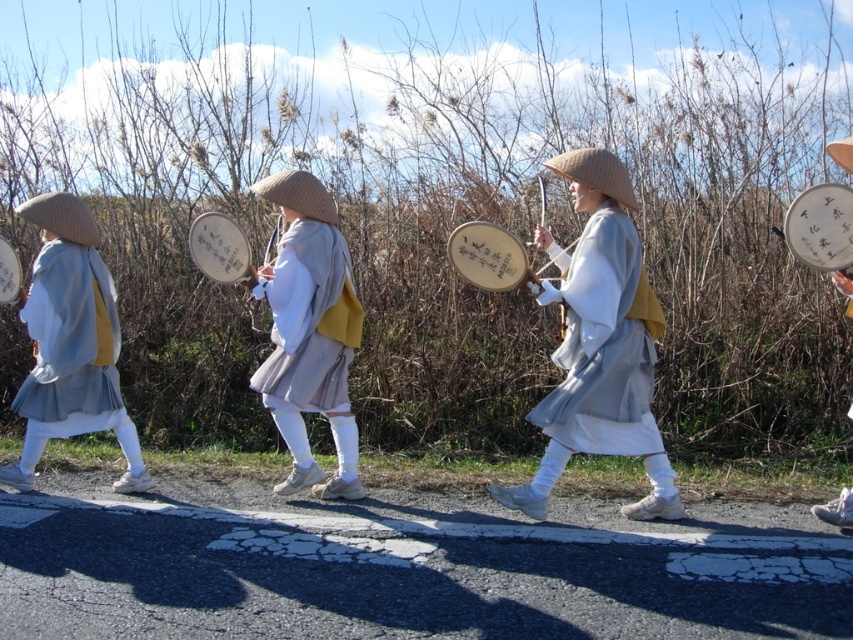
You are a photographer trying to capture the cultural procession. You notice the matte gray kimono at center and the wooden drum at left. Which object should you focus on first to ensure it appears larger in your photo?

The matte gray kimono at center is closer to the viewer than the wooden drum at left, so focusing on it first will make it appear larger in the photo.

You are a photographer trying to capture a wide shot of the matte gray kimono at center and the wooden drum at left. Based on their sizes, which object should you focus on to ensure both fit in the frame?

The matte gray kimono at center might be wider than wooden drum at left, so focusing on the matte gray kimono at center would ensure both fit in the frame as it is the wider object.